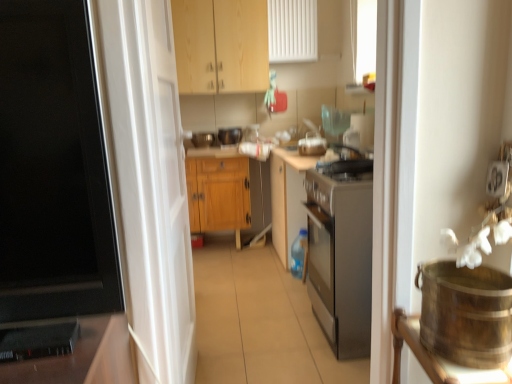
At what (x,y) coordinates should I click in order to perform the action: click on wooden cabinet at center, which is the second cabinetry in top-to-bottom order. Please return your answer as a coordinate pair (x, y). Looking at the image, I should click on (218, 194).

Which is behind, wooden cabinet at upper center, arranged as the first cabinetry when viewed from the top, or white glossy door at center?

wooden cabinet at upper center, arranged as the first cabinetry when viewed from the top, is behind.

The width and height of the screenshot is (512, 384). Identify the location of screen door located in front of the wooden cabinet at upper center, acting as the 2th cabinetry starting from the bottom. (148, 182).

From a real-world perspective, is wooden cabinet at upper center, arranged as the first cabinetry when viewed from the top, below white glossy door at center?

No, from a real-world perspective, wooden cabinet at upper center, arranged as the first cabinetry when viewed from the top, is not beneath white glossy door at center.

Considering the sizes of objects wooden cabinet at upper center, arranged as the first cabinetry when viewed from the top, and white glossy door at center in the image provided, who is wider, wooden cabinet at upper center, arranged as the first cabinetry when viewed from the top, or white glossy door at center?

wooden cabinet at upper center, arranged as the first cabinetry when viewed from the top, is wider.

Based on the photo, which of these two, wooden cabinet at center, acting as the 1th cabinetry starting from the bottom, or black plastic speaker at lower left, is wider?

wooden cabinet at center, acting as the 1th cabinetry starting from the bottom, is wider.

Can you confirm if wooden cabinet at center, which is the second cabinetry in top-to-bottom order, is taller than black plastic speaker at lower left?

Indeed, wooden cabinet at center, which is the second cabinetry in top-to-bottom order, has a greater height compared to black plastic speaker at lower left.

Measure the distance between wooden cabinet at center, acting as the 1th cabinetry starting from the bottom, and black plastic speaker at lower left.

wooden cabinet at center, acting as the 1th cabinetry starting from the bottom, is 2.50 meters away from black plastic speaker at lower left.

Is black plastic speaker at lower left oriented towards white glossy door at center?

No, black plastic speaker at lower left does not turn towards white glossy door at center.

Does black plastic speaker at lower left have a greater height compared to white glossy door at center?

In fact, black plastic speaker at lower left may be shorter than white glossy door at center.

Is black plastic speaker at lower left to the left of white glossy door at center from the viewer's perspective?

Indeed, black plastic speaker at lower left is positioned on the left side of white glossy door at center.

Is black plastic speaker at lower left far from white glossy door at center?

No.

Considering the relative sizes of white glossy door at center and wooden cabinet at center, acting as the 1th cabinetry starting from the bottom, in the image provided, is white glossy door at center smaller than wooden cabinet at center, acting as the 1th cabinetry starting from the bottom,?

Indeed, white glossy door at center has a smaller size compared to wooden cabinet at center, acting as the 1th cabinetry starting from the bottom.

How much distance is there between white glossy door at center and wooden cabinet at center, which is the second cabinetry in top-to-bottom order?

A distance of 5.12 feet exists between white glossy door at center and wooden cabinet at center, which is the second cabinetry in top-to-bottom order.

Is white glossy door at center facing away from wooden cabinet at center, acting as the 1th cabinetry starting from the bottom?

No, wooden cabinet at center, acting as the 1th cabinetry starting from the bottom, is not at the back of white glossy door at center.

Is white glossy door at center not near wooden cabinet at center, which is the second cabinetry in top-to-bottom order?

Yes.

Is black plastic speaker at lower left aimed at wooden cabinet at upper center, arranged as the first cabinetry when viewed from the top?

No, black plastic speaker at lower left is not facing towards wooden cabinet at upper center, arranged as the first cabinetry when viewed from the top.

Does point (22, 327) come in front of point (267, 84)?

That is True.

Considering the relative sizes of black plastic speaker at lower left and wooden cabinet at upper center, acting as the 2th cabinetry starting from the bottom, in the image provided, is black plastic speaker at lower left bigger than wooden cabinet at upper center, acting as the 2th cabinetry starting from the bottom,?

No.

From the picture: Is black plastic speaker at lower left in contact with wooden cabinet at center, which is the second cabinetry in top-to-bottom order?

black plastic speaker at lower left and wooden cabinet at center, which is the second cabinetry in top-to-bottom order, are not in contact.

Which is more to the right, black plastic speaker at lower left or wooden cabinet at center, which is the second cabinetry in top-to-bottom order?

Positioned to the right is wooden cabinet at center, which is the second cabinetry in top-to-bottom order.

Which cabinetry is the 1st one when counting from the right side of the black plastic speaker at lower left? Please provide its 2D coordinates.

[(218, 194)]

Considering the relative sizes of black plastic speaker at lower left and wooden cabinet at center, acting as the 1th cabinetry starting from the bottom, in the image provided, is black plastic speaker at lower left thinner than wooden cabinet at center, acting as the 1th cabinetry starting from the bottom,?

Yes, black plastic speaker at lower left is thinner than wooden cabinet at center, acting as the 1th cabinetry starting from the bottom.

Considering the sizes of white glossy door at center and wooden cabinet at upper center, arranged as the first cabinetry when viewed from the top, in the image, is white glossy door at center bigger or smaller than wooden cabinet at upper center, arranged as the first cabinetry when viewed from the top,?

In the image, white glossy door at center appears to be smaller than wooden cabinet at upper center, arranged as the first cabinetry when viewed from the top.

In the scene shown: Could wooden cabinet at upper center, arranged as the first cabinetry when viewed from the top, be considered to be inside white glossy door at center?

No, wooden cabinet at upper center, arranged as the first cabinetry when viewed from the top, is not a part of white glossy door at center.

Which object is positioned more to the left, white glossy door at center or wooden cabinet at upper center, acting as the 2th cabinetry starting from the bottom?

From the viewer's perspective, white glossy door at center appears more on the left side.

What's the angular difference between white glossy door at center and wooden cabinet at upper center, arranged as the first cabinetry when viewed from the top,'s facing directions?

There is a 88.3-degree angle between the facing directions of white glossy door at center and wooden cabinet at upper center, arranged as the first cabinetry when viewed from the top.

This screenshot has width=512, height=384. I want to click on screen door lying in front of the wooden cabinet at upper center, acting as the 2th cabinetry starting from the bottom, so click(x=148, y=182).

The height and width of the screenshot is (384, 512). In order to click on cabinetry that is the 1st object to the right of the black plastic speaker at lower left, starting at the anchor in this screenshot , I will do `click(218, 194)`.

Considering their positions, is white glossy door at center positioned closer to black plastic speaker at lower left than wooden cabinet at upper center, acting as the 2th cabinetry starting from the bottom?

The object closer to black plastic speaker at lower left is white glossy door at center.

Which object lies nearer to the anchor point wooden cabinet at center, acting as the 1th cabinetry starting from the bottom, wooden cabinet at upper center, arranged as the first cabinetry when viewed from the top, or white glossy door at center?

The object closer to wooden cabinet at center, acting as the 1th cabinetry starting from the bottom, is wooden cabinet at upper center, arranged as the first cabinetry when viewed from the top.

Consider the image. Based on their spatial positions, is wooden cabinet at upper center, arranged as the first cabinetry when viewed from the top, or black plastic speaker at lower left further from wooden cabinet at center, acting as the 1th cabinetry starting from the bottom?

The object further to wooden cabinet at center, acting as the 1th cabinetry starting from the bottom, is black plastic speaker at lower left.

Consider the image. When comparing their distances from wooden cabinet at center, acting as the 1th cabinetry starting from the bottom, does white glossy door at center or black plastic speaker at lower left seem further?

Among the two, black plastic speaker at lower left is located further to wooden cabinet at center, acting as the 1th cabinetry starting from the bottom.

Estimate the real-world distances between objects in this image. Which object is closer to white glossy door at center, wooden cabinet at center, which is the second cabinetry in top-to-bottom order, or black plastic speaker at lower left?

Based on the image, black plastic speaker at lower left appears to be nearer to white glossy door at center.

Looking at the image, which one is located closer to wooden cabinet at center, acting as the 1th cabinetry starting from the bottom, white glossy door at center or wooden cabinet at upper center, acting as the 2th cabinetry starting from the bottom?

Among the two, wooden cabinet at upper center, acting as the 2th cabinetry starting from the bottom, is located nearer to wooden cabinet at center, acting as the 1th cabinetry starting from the bottom.

Looking at the image, which one is located closer to black plastic speaker at lower left, wooden cabinet at upper center, arranged as the first cabinetry when viewed from the top, or white glossy door at center?

white glossy door at center is closer to black plastic speaker at lower left.

Considering their positions, is black plastic speaker at lower left positioned closer to wooden cabinet at center, which is the second cabinetry in top-to-bottom order, than wooden cabinet at upper center, acting as the 2th cabinetry starting from the bottom?

The object closer to wooden cabinet at center, which is the second cabinetry in top-to-bottom order, is wooden cabinet at upper center, acting as the 2th cabinetry starting from the bottom.

Locate an element on the screen. This screenshot has width=512, height=384. screen door between black plastic speaker at lower left and wooden cabinet at upper center, arranged as the first cabinetry when viewed from the top, along the z-axis is located at coordinates (148, 182).

Locate an element on the screen. cabinetry located between white glossy door at center and wooden cabinet at center, which is the second cabinetry in top-to-bottom order, in the depth direction is located at coordinates (221, 46).

Find the location of a particular element. The width and height of the screenshot is (512, 384). screen door located between black plastic speaker at lower left and wooden cabinet at center, which is the second cabinetry in top-to-bottom order, in the depth direction is located at coordinates (148, 182).

Find the location of `cabinetry positioned between black plastic speaker at lower left and wooden cabinet at center, which is the second cabinetry in top-to-bottom order, from near to far`. cabinetry positioned between black plastic speaker at lower left and wooden cabinet at center, which is the second cabinetry in top-to-bottom order, from near to far is located at coordinates (221, 46).